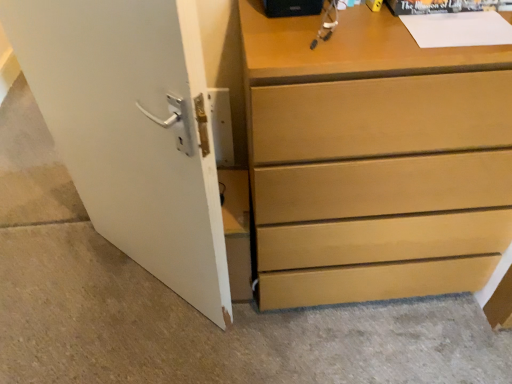
Question: Is matte wood chest of drawers at center bigger than white matte door at left?

Choices:
 (A) yes
 (B) no

Answer: (A)

Question: Is matte wood chest of drawers at center at the left side of white matte door at left?

Choices:
 (A) yes
 (B) no

Answer: (B)

Question: From the image's perspective, is matte wood chest of drawers at center below white matte door at left?

Choices:
 (A) yes
 (B) no

Answer: (B)

Question: Can you confirm if matte wood chest of drawers at center is taller than white matte door at left?

Choices:
 (A) yes
 (B) no

Answer: (B)

Question: Can you confirm if matte wood chest of drawers at center is thinner than white matte door at left?

Choices:
 (A) yes
 (B) no

Answer: (B)

Question: Is matte wood chest of drawers at center not near white matte door at left?

Choices:
 (A) yes
 (B) no

Answer: (B)

Question: Considering the relative positions of white matte door at left and matte wood chest of drawers at center in the image provided, is white matte door at left to the left of matte wood chest of drawers at center from the viewer's perspective?

Choices:
 (A) no
 (B) yes

Answer: (B)

Question: From a real-world perspective, is white matte door at left over matte wood chest of drawers at center?

Choices:
 (A) yes
 (B) no

Answer: (A)

Question: From the image's perspective, is white matte door at left above matte wood chest of drawers at center?

Choices:
 (A) no
 (B) yes

Answer: (A)

Question: Does white matte door at left have a greater width compared to matte wood chest of drawers at center?

Choices:
 (A) yes
 (B) no

Answer: (B)

Question: Considering the relative sizes of white matte door at left and matte wood chest of drawers at center in the image provided, is white matte door at left thinner than matte wood chest of drawers at center?

Choices:
 (A) no
 (B) yes

Answer: (B)

Question: Can you confirm if white matte door at left is shorter than matte wood chest of drawers at center?

Choices:
 (A) yes
 (B) no

Answer: (B)

Question: Does point (496, 213) appear closer or farther from the camera than point (133, 206)?

Choices:
 (A) closer
 (B) farther

Answer: (A)